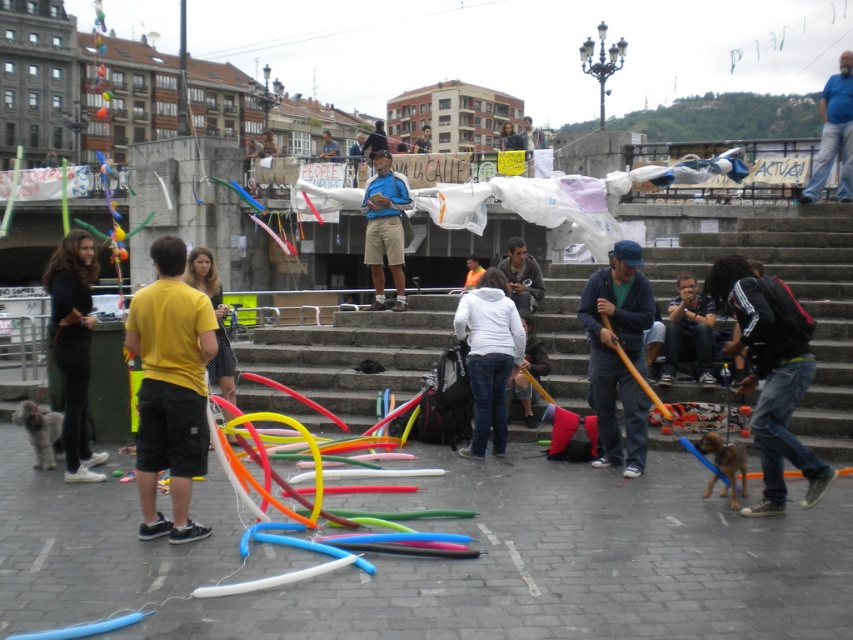
You are a photographer standing in the plaza and see the black matte pants at left and the matte blue shirt at center. Which object is closer to the ground?

The black matte pants at left is positioned under the matte blue shirt at center, so it is closer to the ground.

Where is the matte blue jacket at center located in the image?

The matte blue jacket at center is located at point (618, 355).

You are a photographer standing at the edge of the plaza. You want to take a photo of the matte blue jacket at center and the blue denim jeans at center so that both are in the frame. Given that your camera has a maximum focal length that allows capturing objects up to 50 meters apart in the same frame, will you be able to include both in a single shot?

The matte blue jacket at center and blue denim jeans at center are 54.80 meters apart from each other. Since the maximum distance your camera can capture in one frame is 50 meters, you won answer to be able to include both in a single shot because the distance exceeds the camera